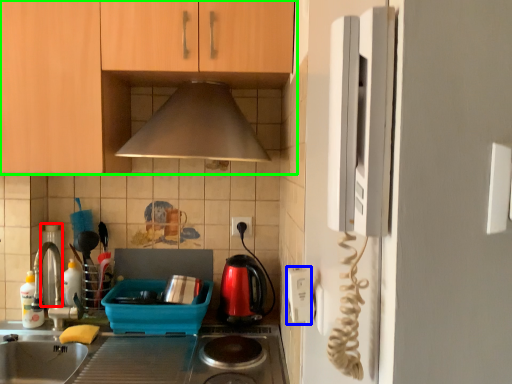
Question: Which object is the closest to the appliance (highlighted by a red box)? Choose among these: electric outlet (highlighted by a blue box) or cabinetry (highlighted by a green box).

Choices:
 (A) electric outlet
 (B) cabinetry

Answer: (B)